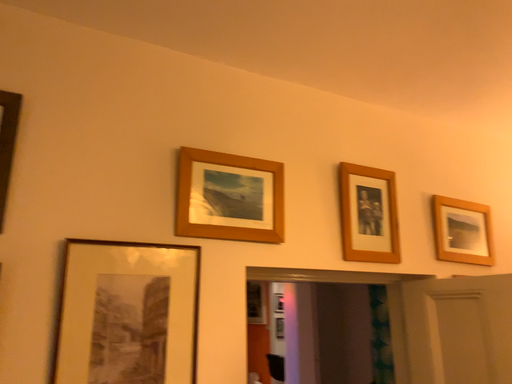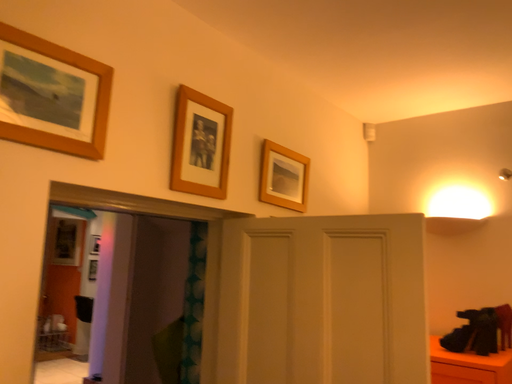
Question: How did the camera likely rotate when shooting the video?

Choices:
 (A) rotated downward
 (B) rotated upward

Answer: (A)